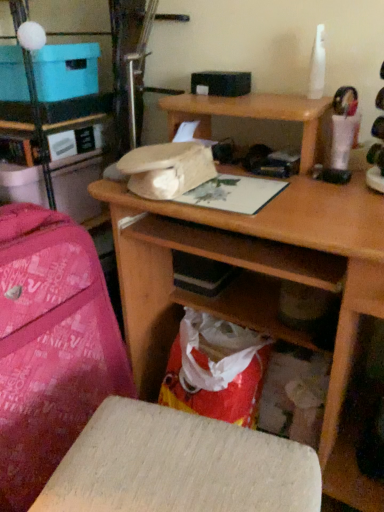
Locate an element on the screen. The image size is (384, 512). empty space that is ontop of wooden stool at lower center (from a real-world perspective) is located at coordinates (176, 461).